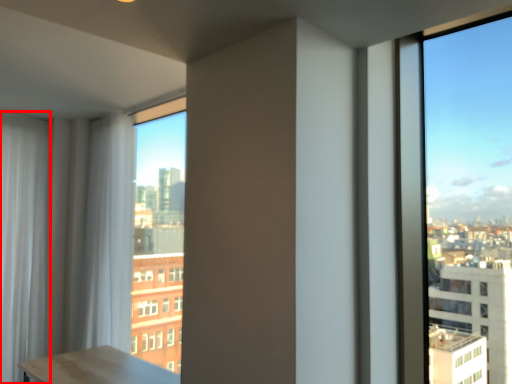
Question: In this image, where is curtain (annotated by the red box) located relative to curtain?

Choices:
 (A) left
 (B) right

Answer: (A)